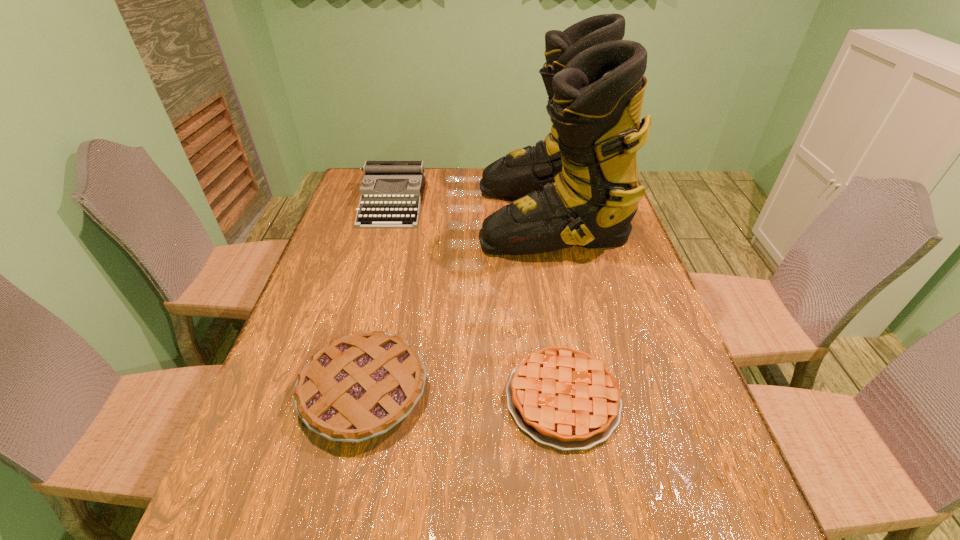
Identify the location of ski boots at the far edge. Image resolution: width=960 pixels, height=540 pixels. (579, 186).

The image size is (960, 540). What are the coordinates of `typewriter situated at the far edge` in the screenshot? It's located at (391, 192).

This screenshot has height=540, width=960. Identify the location of typewriter present at the left edge. click(x=391, y=192).

Find the location of a particular element. Image resolution: width=960 pixels, height=540 pixels. pie at the left edge is located at coordinates (360, 386).

Identify the location of object that is at the right edge. The image size is (960, 540). point(579,186).

Where is `object that is at the far left corner`? object that is at the far left corner is located at coordinates (391, 192).

Find the location of a particular element. The width and height of the screenshot is (960, 540). object positioned at the far right corner is located at coordinates (579, 186).

What are the coordinates of `vacant position at the near edge of the desktop` in the screenshot? It's located at (597, 524).

Locate an element on the screen. vacant space at the left edge of the desktop is located at coordinates (318, 436).

Locate an element on the screen. Image resolution: width=960 pixels, height=540 pixels. free location at the right edge of the desktop is located at coordinates (619, 357).